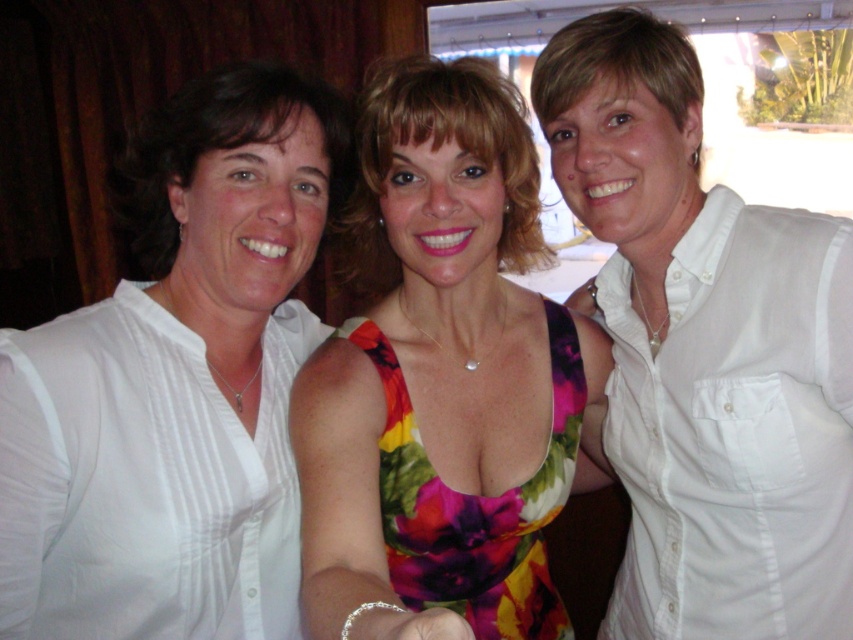
Question: Does white cotton shirt at right appear over floral dress at center?

Choices:
 (A) no
 (B) yes

Answer: (B)

Question: Which point is closer to the camera?

Choices:
 (A) (525, 314)
 (B) (659, 157)

Answer: (B)

Question: Which point is closer to the camera taking this photo?

Choices:
 (A) (173, 230)
 (B) (570, 460)

Answer: (B)

Question: Which of the following is the farthest from the observer?

Choices:
 (A) white satin blouse at left
 (B) white cotton shirt at right

Answer: (B)

Question: Is white satin blouse at left to the left of floral dress at center from the viewer's perspective?

Choices:
 (A) yes
 (B) no

Answer: (A)

Question: Is white satin blouse at left thinner than floral dress at center?

Choices:
 (A) no
 (B) yes

Answer: (B)